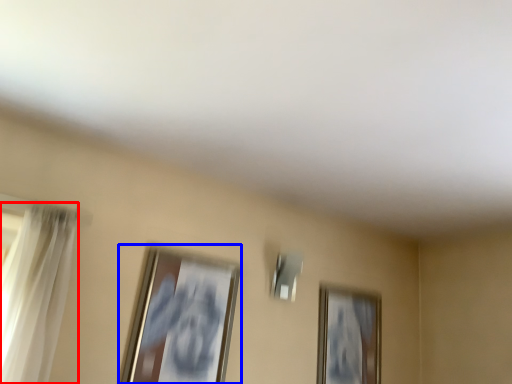
Question: Which object appears farthest to the camera in this image, curtain (highlighted by a red box) or picture frame (highlighted by a blue box)?

Choices:
 (A) curtain
 (B) picture frame

Answer: (B)